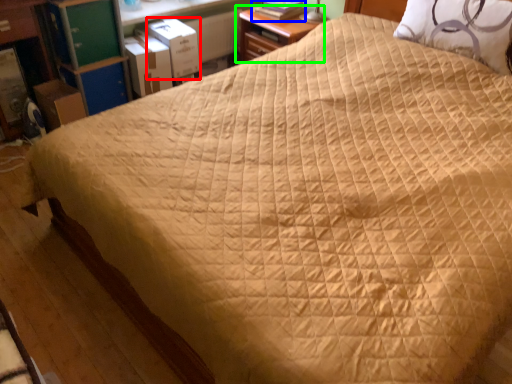
Question: Estimate the real-world distances between objects in this image. Which object is closer to cardboard box (highlighted by a red box), book (highlighted by a blue box) or nightstand (highlighted by a green box)?

Choices:
 (A) book
 (B) nightstand

Answer: (B)